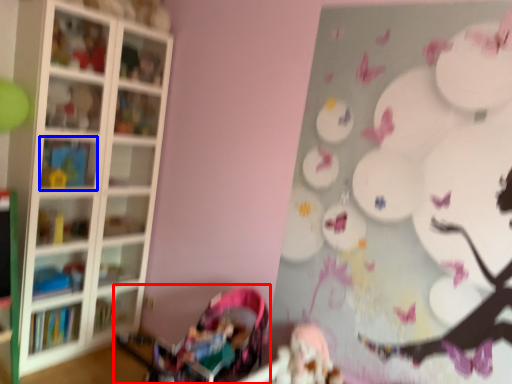
Question: Which object appears closest to the camera in this image, baby carriage (highlighted by a red box) or shelf (highlighted by a blue box)?

Choices:
 (A) baby carriage
 (B) shelf

Answer: (A)